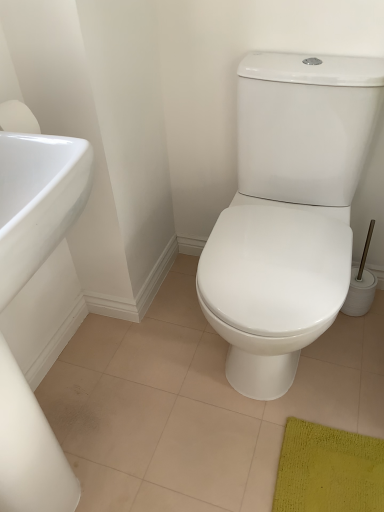
Locate an element on the screen. This screenshot has height=512, width=384. free space that is to the left of white glossy toilet at center is located at coordinates (158, 345).